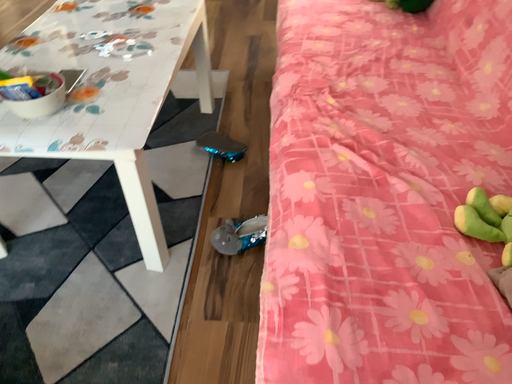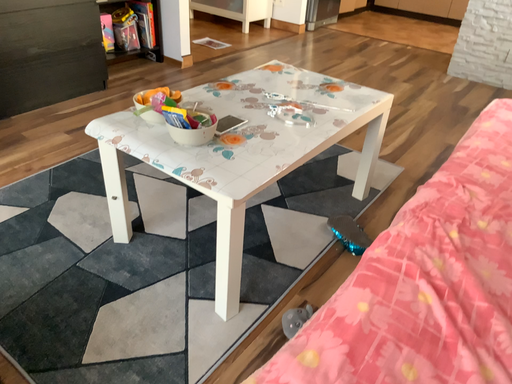
Question: Which way did the camera rotate in the video?

Choices:
 (A) rotated downward
 (B) rotated upward

Answer: (B)